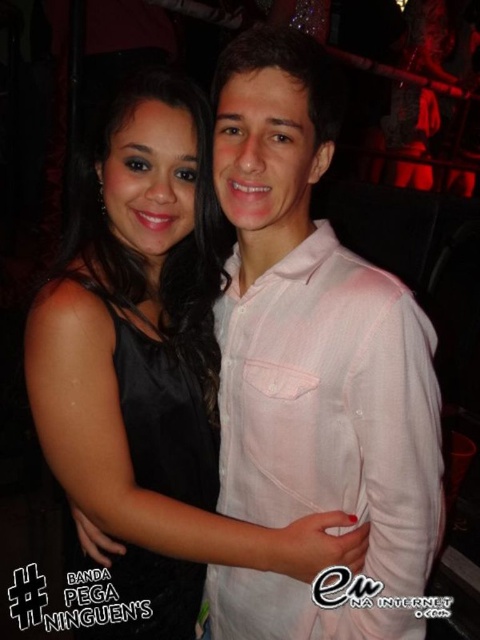
Is black satin dress at center bigger than pink cotton shirt at center?

Yes, black satin dress at center is bigger than pink cotton shirt at center.

Looking at this image, can you confirm if black satin dress at center is positioned to the right of pink cotton shirt at center?

No, black satin dress at center is not to the right of pink cotton shirt at center.

Based on the photo, measure the distance between point (x=210, y=168) and camera.

Point (x=210, y=168) and camera are 3.55 feet apart from each other.

You are a GUI agent. You are given a task and a screenshot of the screen. Output one action in this format:
    pyautogui.click(x=<x>, y=<y>)
    Task: Click on the black satin dress at center
    
    Given the screenshot: What is the action you would take?
    pyautogui.click(x=151, y=369)

Does pink cotton shirt at center have a larger size compared to black satin dress at left?

No.

Does pink cotton shirt at center have a greater width compared to black satin dress at left?

Yes.

Between point (297, 449) and point (116, 365), which one is positioned behind?

The point (116, 365) is behind.

Where is `pink cotton shirt at center`? The image size is (480, 640). pink cotton shirt at center is located at coordinates (333, 404).

Image resolution: width=480 pixels, height=640 pixels. In order to click on black satin dress at center in this screenshot , I will do `click(151, 369)`.

Between point (159, 612) and point (142, 348), which one is positioned behind?

Point (159, 612)

I want to click on black satin dress at center, so click(x=151, y=369).